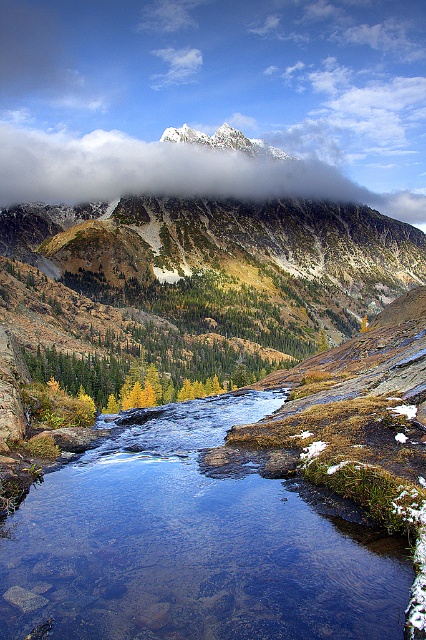
You are standing at the point marked by coordinates point (189, 545) in the mountainous landscape. What do you see around you?

You are standing at the clear water stream at center, which is represented by point (189, 545). Around you, the stream meanders through rocky terrain with patches of snow and grass, reflecting the blue sky above, and clear water reveals submerged rocks beneath.

From the picture: You are planning to hike along the clear water stream at center and want to reach the white fluffy cloud at upper center. Based on the distance provided, is this feasible? Please explain why or why not.

The distance between the clear water stream at center and the white fluffy cloud at upper center is 1445.31 feet. However, clouds are located in the sky and cannot be physically reached by hiking on the ground. Therefore, it is not feasible to hike to the white fluffy cloud at upper center.

You are planning to take a photo of the clear water stream at center and the white fluffy cloud at upper center. Which object should you focus on first if you want to capture both in a single frame without moving the camera?

The clear water stream at center is smaller than the white fluffy cloud at upper center, so you should focus on the clear water stream at center first to ensure it is centered and properly framed before adjusting for the larger cloud.